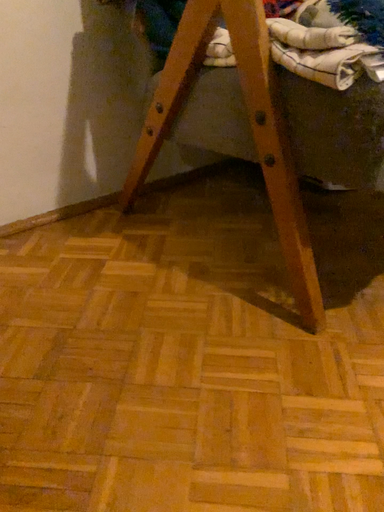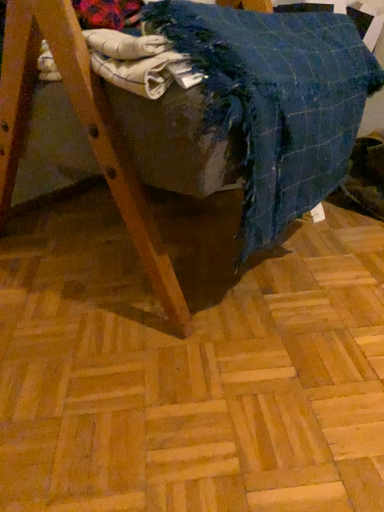
Question: Which way did the camera rotate in the video?

Choices:
 (A) rotated right
 (B) rotated left

Answer: (A)